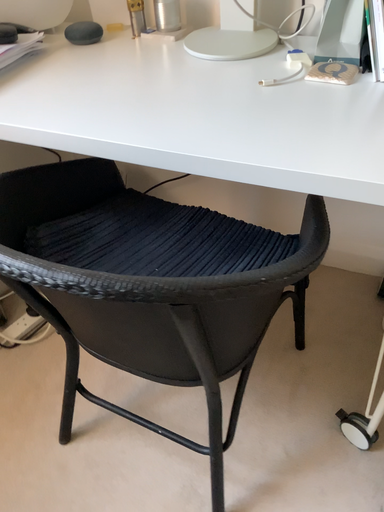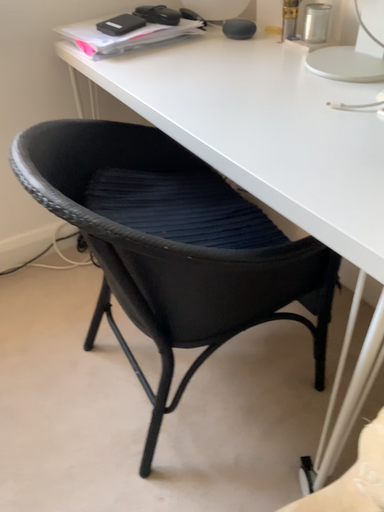
Question: Which way did the camera rotate in the video?

Choices:
 (A) rotated right
 (B) rotated left

Answer: (B)